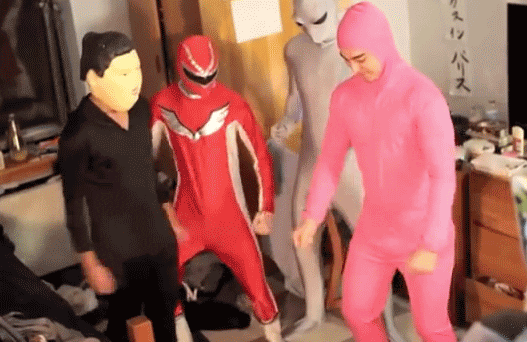
This screenshot has width=527, height=342. Identify the location of white wall. (42, 217).